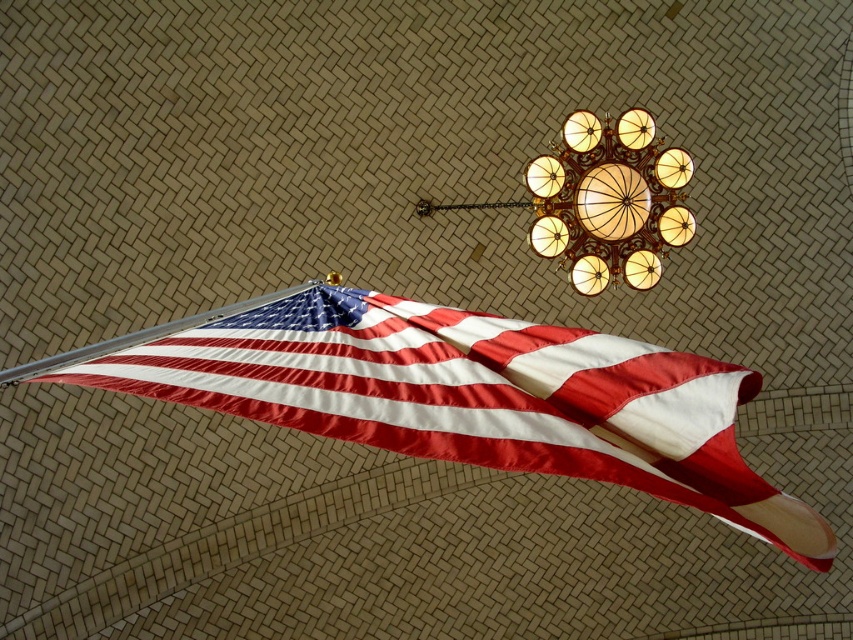
Question: Is silky fabric flag at lower left further to camera compared to silky fabric flag pole at lower left?

Choices:
 (A) yes
 (B) no

Answer: (B)

Question: Which object is farther from the camera taking this photo?

Choices:
 (A) matte gold chandelier at upper center
 (B) silky fabric flag at lower left

Answer: (A)

Question: Can you confirm if matte gold chandelier at upper center is wider than silky fabric flag pole at lower left?

Choices:
 (A) yes
 (B) no

Answer: (B)

Question: Among these objects, which one is nearest to the camera?

Choices:
 (A) matte gold chandelier at upper center
 (B) silky fabric flag pole at lower left
 (C) silky fabric flag at lower left

Answer: (C)

Question: In this image, where is matte gold chandelier at upper center located relative to silky fabric flag pole at lower left?

Choices:
 (A) right
 (B) left

Answer: (A)

Question: Which point is farther to the camera?

Choices:
 (A) (3, 387)
 (B) (608, 250)

Answer: (A)